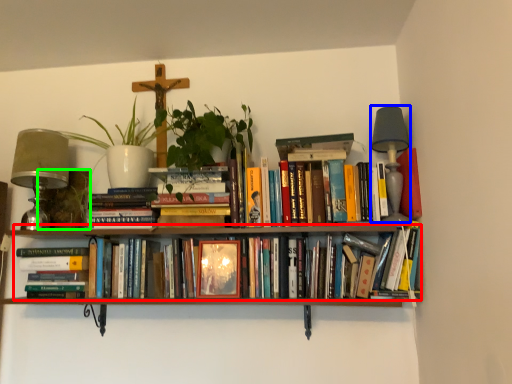
Question: Based on their relative distances, which object is nearer to book (highlighted by a red box)? Choose from table lamp (highlighted by a blue box) and plant (highlighted by a green box).

Choices:
 (A) table lamp
 (B) plant

Answer: (B)